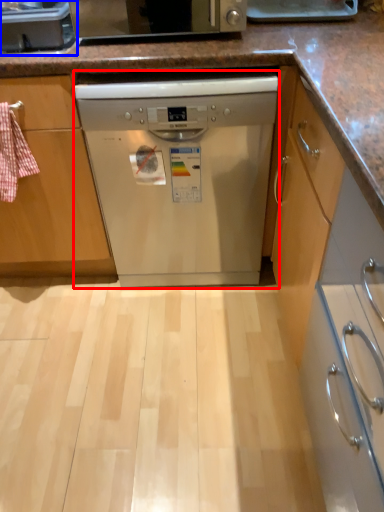
Question: Which object appears closest to the camera in this image, dishwasher (highlighted by a red box) or kitchen appliance (highlighted by a blue box)?

Choices:
 (A) dishwasher
 (B) kitchen appliance

Answer: (B)